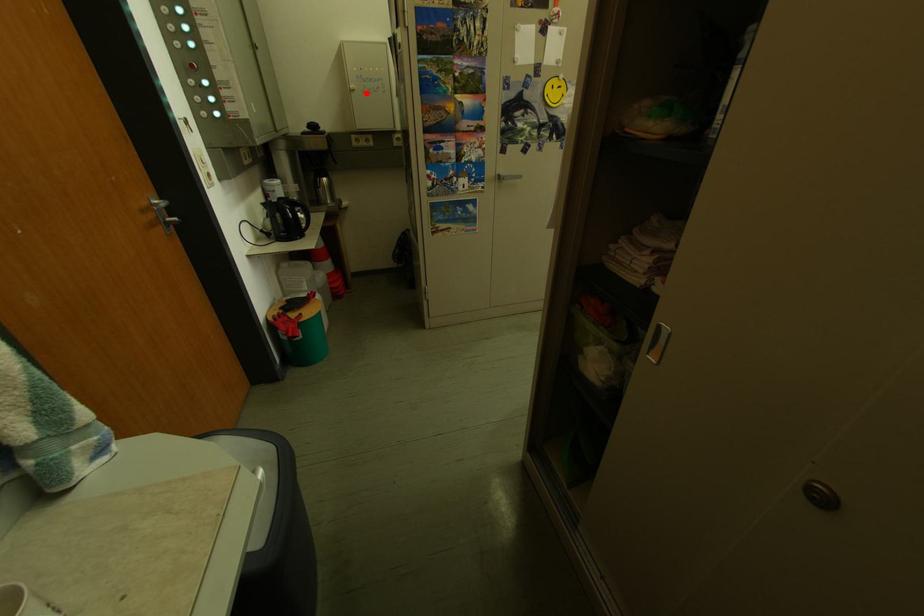
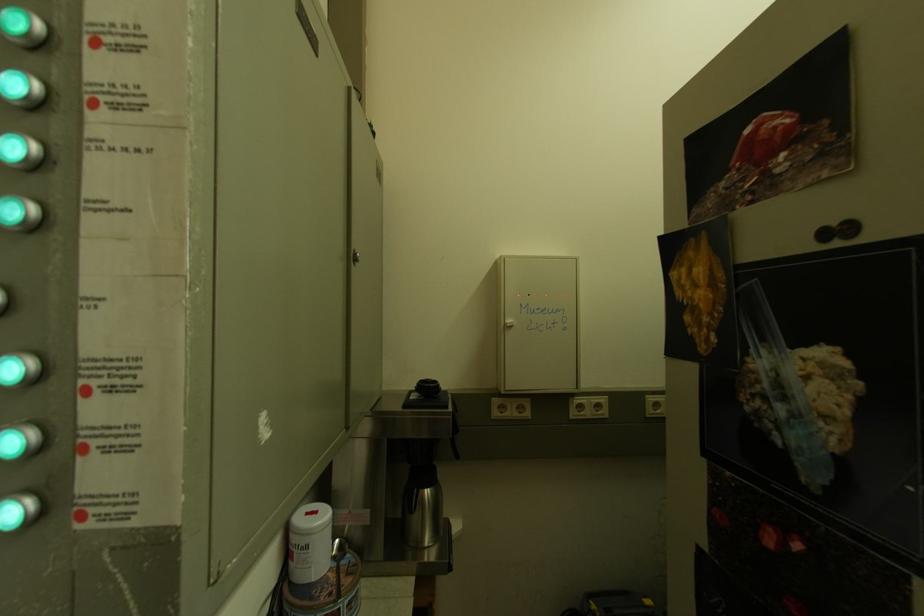
The point at the highlighted location is marked in the first image. Where is the corresponding point in the second image?

(524, 330)